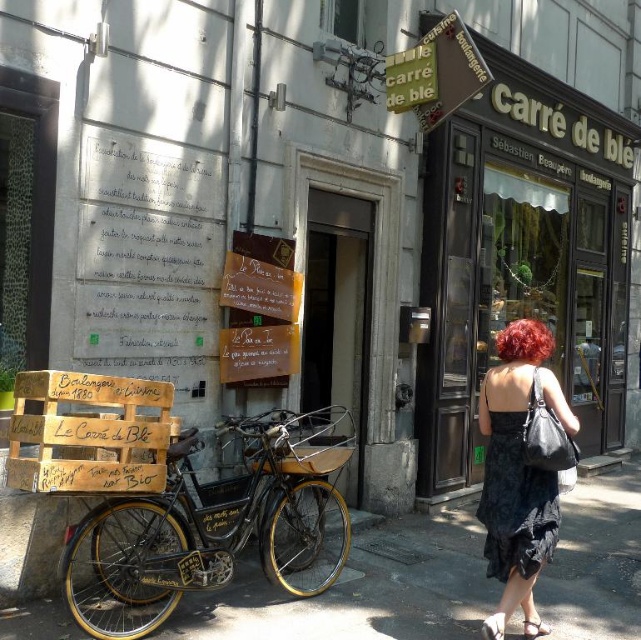
Which of these two, smooth concrete pavement at lower center or black satin dress at lower right, stands taller?

black satin dress at lower right

Does point (476, 525) come farther from viewer compared to point (494, 497)?

Yes, it is behind point (494, 497).

I want to click on smooth concrete pavement at lower center, so click(362, 589).

Does rustic metal bicycle at center have a lesser height compared to wooden crate at lower left?

No.

Which is more to the right, rustic metal bicycle at center or wooden crate at lower left?

Positioned to the right is rustic metal bicycle at center.

Between point (124, 634) and point (65, 488), which one is positioned in front?

Point (65, 488) is in front.

Identify the location of rustic metal bicycle at center. (221, 520).

Can you confirm if wooden crate at lower left is positioned to the right of shiny red hair at center right?

In fact, wooden crate at lower left is to the left of shiny red hair at center right.

Is point (12, 422) positioned behind point (512, 328)?

No, it is in front of (512, 328).

Is point (29, 396) less distant than point (542, 356)?

Yes.

The width and height of the screenshot is (641, 640). I want to click on wooden crate at lower left, so click(88, 433).